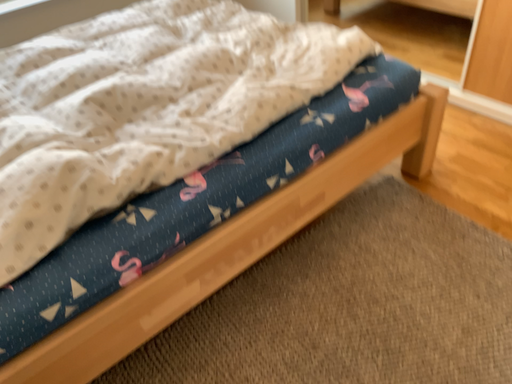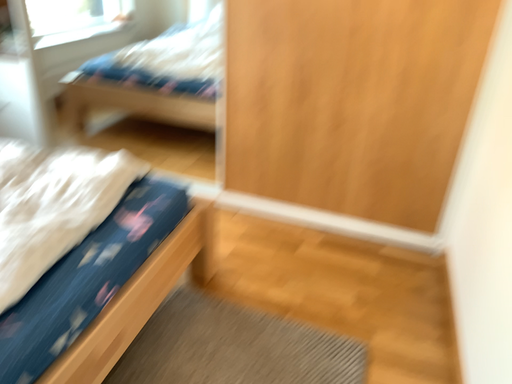
Question: Which way did the camera rotate in the video?

Choices:
 (A) rotated upward
 (B) rotated downward

Answer: (A)